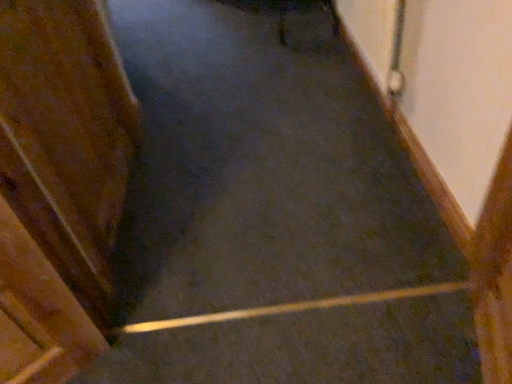
Question: From the image's perspective, is wooden door at left above or below smooth concrete stairs at center?

Choices:
 (A) above
 (B) below

Answer: (A)

Question: Considering their positions, is wooden door at left located in front of or behind smooth concrete stairs at center?

Choices:
 (A) front
 (B) behind

Answer: (A)

Question: Is wooden door at left to the left or to the right of smooth concrete stairs at center in the image?

Choices:
 (A) right
 (B) left

Answer: (B)

Question: Would you say smooth concrete stairs at center is to the left or to the right of wooden door at left in the picture?

Choices:
 (A) left
 (B) right

Answer: (B)

Question: Considering the positions of smooth concrete stairs at center and wooden door at left in the image, is smooth concrete stairs at center bigger or smaller than wooden door at left?

Choices:
 (A) small
 (B) big

Answer: (B)

Question: Considering the positions of smooth concrete stairs at center and wooden door at left in the image, is smooth concrete stairs at center wider or thinner than wooden door at left?

Choices:
 (A) wide
 (B) thin

Answer: (A)

Question: Relative to wooden door at left, is smooth concrete stairs at center in front or behind?

Choices:
 (A) front
 (B) behind

Answer: (B)